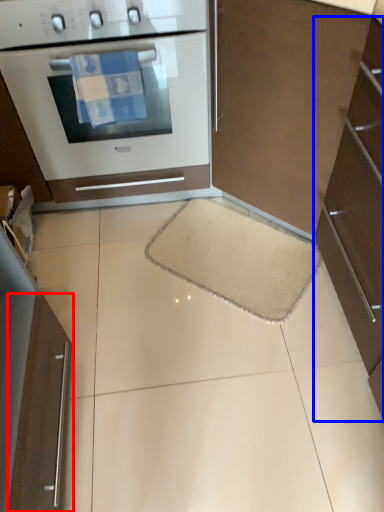
Question: Which point is closer to the camera, appliance (highlighted by a red box) or cabinetry (highlighted by a blue box)?

Choices:
 (A) appliance
 (B) cabinetry

Answer: (B)